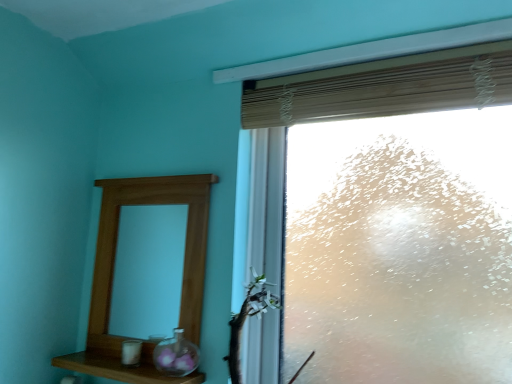
Find the location of a particular element. Image resolution: width=512 pixels, height=384 pixels. green leafy branch at lower right is located at coordinates (246, 317).

In order to face green leafy branch at lower right, should I rotate leftwards or rightwards?

Turn right by 0.546 degrees to look at green leafy branch at lower right.

You are a GUI agent. You are given a task and a screenshot of the screen. Output one action in this format:
    pyautogui.click(x=<x>, y=<y>)
    Task: Click on the wooden blind at upper right
    Image resolution: width=512 pixels, height=384 pixels.
    Given the screenshot: What is the action you would take?
    pyautogui.click(x=380, y=88)

Where is `transparent glass vase at lower center`? Image resolution: width=512 pixels, height=384 pixels. transparent glass vase at lower center is located at coordinates (176, 355).

I want to click on green leafy branch at lower right, so click(246, 317).

Considering the positions of point (182, 185) and point (468, 99), is point (182, 185) closer or farther from the camera than point (468, 99)?

Point (182, 185).

Identify the location of window above the wooden mirror at left (from a real-world perspective). The height and width of the screenshot is (384, 512). (336, 119).

Is wooden mirror at left positioned far away from frosted glass window at upper right?

No, wooden mirror at left is in close proximity to frosted glass window at upper right.

Is wooden mirror at left aimed at frosted glass window at upper right?

No.

Is point (255, 280) behind point (204, 208)?

No, (255, 280) is closer to viewer.

How distant is green leafy branch at lower right from wooden mirror at left?

green leafy branch at lower right and wooden mirror at left are 10.93 inches apart.

Does green leafy branch at lower right have a lesser width compared to wooden mirror at left?

No.

Which object is further away from the camera, green leafy branch at lower right or wooden mirror at left?

wooden mirror at left is more distant.

Between point (377, 72) and point (88, 348), which one is positioned behind?

Positioned behind is point (88, 348).

You are a GUI agent. You are given a task and a screenshot of the screen. Output one action in this format:
    pyautogui.click(x=<x>, y=<y>)
    Task: Click on the medicine cabinet below the wooden blind at upper right (from the image's perspective)
    The height and width of the screenshot is (384, 512).
    Given the screenshot: What is the action you would take?
    114,265

Which of these two, wooden blind at upper right or wooden mirror at left, is thinner?

With smaller width is wooden mirror at left.

From a real-world perspective, is wooden blind at upper right on wooden mirror at left?

Yes, from a real-world perspective, wooden blind at upper right is above wooden mirror at left.

Does wooden blind at upper right turn towards transparent glass vase at lower center?

No, wooden blind at upper right is not oriented towards transparent glass vase at lower center.

Is transparent glass vase at lower center a part of wooden blind at upper right?

No, transparent glass vase at lower center is not surrounded by wooden blind at upper right.

Considering the relative sizes of wooden blind at upper right and transparent glass vase at lower center in the image provided, is wooden blind at upper right thinner than transparent glass vase at lower center?

Yes, wooden blind at upper right is thinner than transparent glass vase at lower center.

From the image's perspective, is wooden shelf at lower left above or below transparent glass vase at lower center?

wooden shelf at lower left is situated lower than transparent glass vase at lower center in the image.

Is wooden shelf at lower left shorter than transparent glass vase at lower center?

Yes.

How many degrees apart are the facing directions of wooden shelf at lower left and transparent glass vase at lower center?

They differ by 0.00199 degrees in their facing directions.

Is there a large distance between wooden shelf at lower left and transparent glass vase at lower center?

They are positioned close to each other.

Is frosted glass window at upper right located outside wooden shelf at lower left?

frosted glass window at upper right is positioned outside wooden shelf at lower left.

Which of these two, frosted glass window at upper right or wooden shelf at lower left, is bigger?

frosted glass window at upper right is bigger.

Between point (266, 107) and point (145, 368), which one is positioned behind?

The point (266, 107) is farther.

Can you confirm if wooden shelf at lower left is taller than frosted glass window at upper right?

In fact, wooden shelf at lower left may be shorter than frosted glass window at upper right.

In the image, there is a wooden shelf at lower left. Where is `window above it (from the image's perspective)`? The height and width of the screenshot is (384, 512). window above it (from the image's perspective) is located at coordinates (336, 119).

Is wooden shelf at lower left beside frosted glass window at upper right?

No, wooden shelf at lower left is not next to frosted glass window at upper right.

Find the location of a particular element. The image size is (512, 384). medicine cabinet lying on the left of frosted glass window at upper right is located at coordinates (114, 265).

Where is `plant on the right of the wooden mirror at left`? This screenshot has height=384, width=512. plant on the right of the wooden mirror at left is located at coordinates (246, 317).

Based on their spatial positions, is wooden blind at upper right or wooden mirror at left further from frosted glass window at upper right?

The object further to frosted glass window at upper right is wooden mirror at left.

From the image, which object appears to be farther from wooden mirror at left, green leafy branch at lower right or transparent glass vase at lower center?

Among the two, green leafy branch at lower right is located further to wooden mirror at left.

Considering their positions, is wooden mirror at left positioned further to wooden blind at upper right than wooden shelf at lower left?

Based on the image, wooden shelf at lower left appears to be further to wooden blind at upper right.

Estimate the real-world distances between objects in this image. Which object is further from green leafy branch at lower right, wooden shelf at lower left or transparent glass vase at lower center?

wooden shelf at lower left is further to green leafy branch at lower right.

Considering their positions, is transparent glass vase at lower center positioned closer to green leafy branch at lower right than wooden shelf at lower left?

transparent glass vase at lower center.

From the image, which object appears to be farther from wooden mirror at left, transparent glass vase at lower center or green leafy branch at lower right?

Based on the image, green leafy branch at lower right appears to be further to wooden mirror at left.

Based on their spatial positions, is wooden shelf at lower left or transparent glass vase at lower center further from wooden blind at upper right?

Among the two, wooden shelf at lower left is located further to wooden blind at upper right.

Considering their positions, is wooden blind at upper right positioned further to wooden mirror at left than transparent glass vase at lower center?

wooden blind at upper right lies further to wooden mirror at left than the other object.

At what (x,y) coordinates should I click in order to perform the action: click on medicine cabinet between wooden shelf at lower left and green leafy branch at lower right in the horizontal direction. Please return your answer as a coordinate pair (x, y). Looking at the image, I should click on (114, 265).

Where is `plant situated between wooden mirror at left and frosted glass window at upper right from left to right`? The image size is (512, 384). plant situated between wooden mirror at left and frosted glass window at upper right from left to right is located at coordinates (246, 317).

This screenshot has width=512, height=384. In order to click on glass vase situated between wooden shelf at lower left and frosted glass window at upper right from left to right in this screenshot , I will do `click(176, 355)`.

I want to click on plant between transparent glass vase at lower center and frosted glass window at upper right, so click(x=246, y=317).